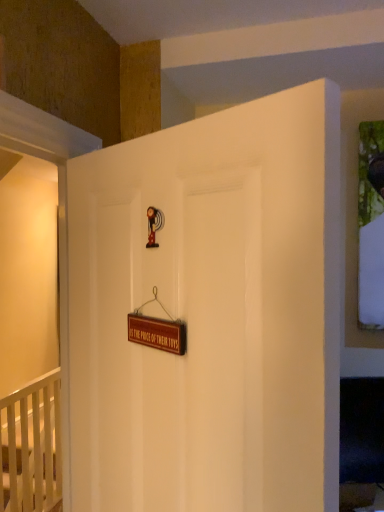
Where is `brown wooden sign at center`? brown wooden sign at center is located at coordinates (157, 333).

Where is `white wooden crib at lower left`? white wooden crib at lower left is located at coordinates (31, 446).

Looking at this image, what is the approximate width of white matte door at center?

It is 2.07 inches.

You are a GUI agent. You are given a task and a screenshot of the screen. Output one action in this format:
    pyautogui.click(x=<x>, y=<y>)
    Task: Click on the white matte door at center
    
    Given the screenshot: What is the action you would take?
    pyautogui.click(x=210, y=312)

At what (x,y) coordinates should I click in order to perform the action: click on brown wooden sign at center. Please return your answer as a coordinate pair (x, y). The height and width of the screenshot is (512, 384). Looking at the image, I should click on (157, 333).

Considering the sizes of objects brown wooden sign at center and white matte door at center in the image provided, who is taller, brown wooden sign at center or white matte door at center?

white matte door at center.

Looking at this image, is brown wooden sign at center facing towards white matte door at center?

Yes, brown wooden sign at center faces towards white matte door at center.

Is brown wooden sign at center beside white matte door at center?

No, brown wooden sign at center is not making contact with white matte door at center.

From a real-world perspective, who is located lower, brown wooden sign at center or white matte door at center?

In real-world perspective, white matte door at center is lower.

Based on the photo, who is taller, white matte door at center or white wooden crib at lower left?

With more height is white matte door at center.

Is white matte door at center far from white wooden crib at lower left?

That's right, there is a large distance between white matte door at center and white wooden crib at lower left.

Which object is more forward, white matte door at center or white wooden crib at lower left?

Positioned in front is white matte door at center.

In the scene shown: Between white matte door at center and white wooden crib at lower left, which one has larger size?

white wooden crib at lower left.

Is white wooden crib at lower left far from white matte door at center?

Absolutely, white wooden crib at lower left is distant from white matte door at center.

At what (x,y) coordinates should I click in order to perform the action: click on infant bed below the white matte door at center (from the image's perspective). Please return your answer as a coordinate pair (x, y). Looking at the image, I should click on (31, 446).

Who is taller, white wooden crib at lower left or white matte door at center?

With more height is white matte door at center.

In terms of width, does white wooden crib at lower left look wider or thinner when compared to white matte door at center?

Considering their sizes, white wooden crib at lower left looks broader than white matte door at center.

Which of these two, brown wooden sign at center or white wooden crib at lower left, is smaller?

brown wooden sign at center.

Between brown wooden sign at center and white wooden crib at lower left, which one appears on the left side from the viewer's perspective?

From the viewer's perspective, white wooden crib at lower left appears more on the left side.

From the image's perspective, who appears lower, brown wooden sign at center or white wooden crib at lower left?

white wooden crib at lower left is shown below in the image.

Is point (27, 455) positioned in front of point (132, 340)?

No, it is not.

Who is shorter, white wooden crib at lower left or brown wooden sign at center?

Standing shorter between the two is brown wooden sign at center.

From a real-world perspective, is white wooden crib at lower left positioned above or below brown wooden sign at center?

In terms of real-world spatial position, white wooden crib at lower left is below brown wooden sign at center.

From the image's perspective, which object appears higher, white wooden crib at lower left or brown wooden sign at center?

From the image's view, brown wooden sign at center is above.

From a real-world perspective, does white matte door at center stand above brown wooden sign at center?

No, from a real-world perspective, white matte door at center is not over brown wooden sign at center

Is brown wooden sign at center inside white matte door at center?

Yes, brown wooden sign at center is a part of white matte door at center.

Looking at this image, is white matte door at center taller than brown wooden sign at center?

Yes.

From the picture: Which of these two, white matte door at center or brown wooden sign at center, is smaller?

brown wooden sign at center is smaller.

Identify the location of door that is in front of the brown wooden sign at center. (210, 312).

Identify the location of infant bed lying on the left of white matte door at center. The image size is (384, 512). (31, 446).

From the image, which object appears to be nearer to brown wooden sign at center, white matte door at center or white wooden crib at lower left?

white matte door at center.

Considering their positions, is white wooden crib at lower left positioned closer to brown wooden sign at center than white matte door at center?

white matte door at center lies closer to brown wooden sign at center than the other object.

Consider the image. From the image, which object appears to be nearer to white wooden crib at lower left, brown wooden sign at center or white matte door at center?

white matte door at center is closer to white wooden crib at lower left.

Based on their spatial positions, is white wooden crib at lower left or brown wooden sign at center closer to white matte door at center?

brown wooden sign at center lies closer to white matte door at center than the other object.

Estimate the real-world distances between objects in this image. Which object is further from white wooden crib at lower left, white matte door at center or brown wooden sign at center?

brown wooden sign at center is positioned further to the anchor white wooden crib at lower left.

Based on their spatial positions, is brown wooden sign at center or white wooden crib at lower left further from white matte door at center?

white wooden crib at lower left is positioned further to the anchor white matte door at center.

I want to click on plaque located between white matte door at center and white wooden crib at lower left in the depth direction, so click(x=157, y=333).